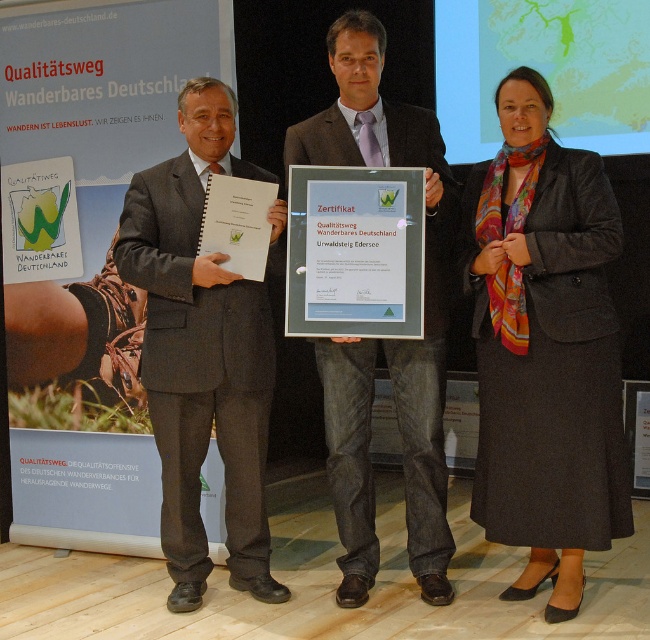
Can you confirm if dark gray suit at center is wider than green glass certificate at center?

Yes, dark gray suit at center is wider than green glass certificate at center.

Does dark gray suit at center have a lesser height compared to green glass certificate at center?

In fact, dark gray suit at center may be taller than green glass certificate at center.

Is point (250, 352) closer to camera compared to point (369, 266)?

That is False.

Where is `dark gray suit at center`? The height and width of the screenshot is (640, 650). dark gray suit at center is located at coordinates (202, 353).

Can you confirm if dark gray suit at center is positioned to the right of matte black suit at center?

No, dark gray suit at center is not to the right of matte black suit at center.

You are a GUI agent. You are given a task and a screenshot of the screen. Output one action in this format:
    pyautogui.click(x=<x>, y=<y>)
    Task: Click on the dark gray suit at center
    This screenshot has height=640, width=650.
    Given the screenshot: What is the action you would take?
    pyautogui.click(x=202, y=353)

Is point (252, 492) positioned before point (439, 458)?

No.

Image resolution: width=650 pixels, height=640 pixels. I want to click on dark gray suit at center, so click(x=202, y=353).

Who is positioned more to the left, dark gray wool skirt at lower right or green glass certificate at center?

green glass certificate at center is more to the left.

Which of these two, dark gray wool skirt at lower right or green glass certificate at center, stands shorter?

green glass certificate at center

At what (x,y) coordinates should I click in order to perform the action: click on dark gray wool skirt at lower right. Please return your answer as a coordinate pair (x, y). Image resolution: width=650 pixels, height=640 pixels. Looking at the image, I should click on (543, 348).